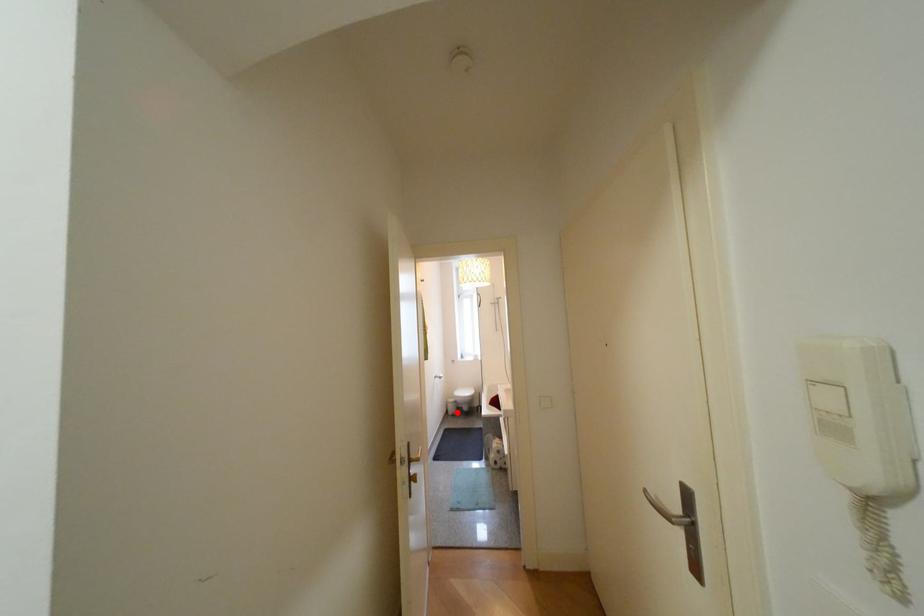
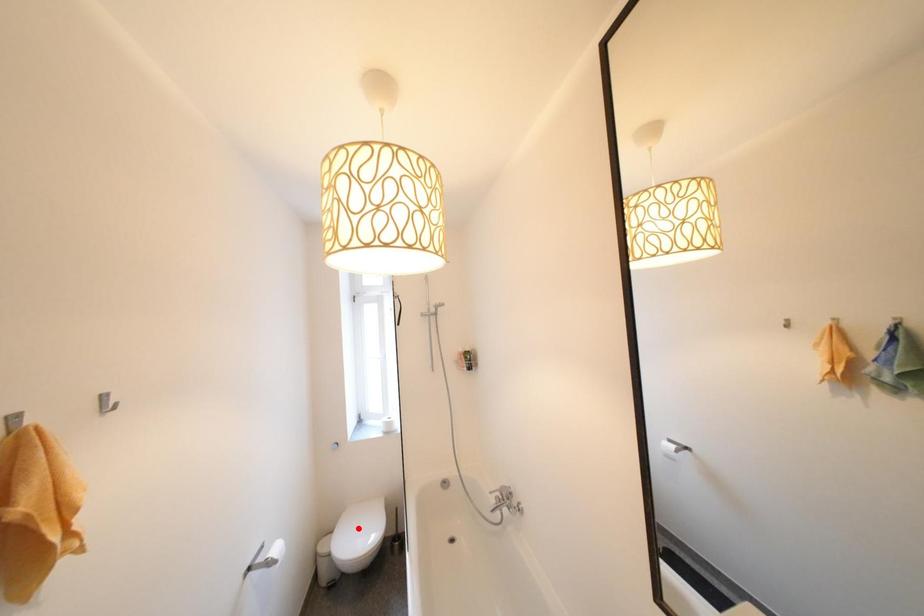
I am providing you with two images of the same scene from different viewpoints. A red point is marked on the first image and another point is marked on the second image. Is the marked point in image1 the same physical position as the marked point in image2?

No